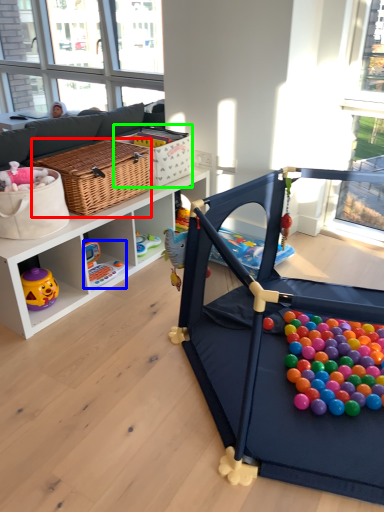
Question: Which is nearer to the picnic basket (highlighted by a red box)? toy (highlighted by a blue box) or basket (highlighted by a green box).

Choices:
 (A) toy
 (B) basket

Answer: (B)